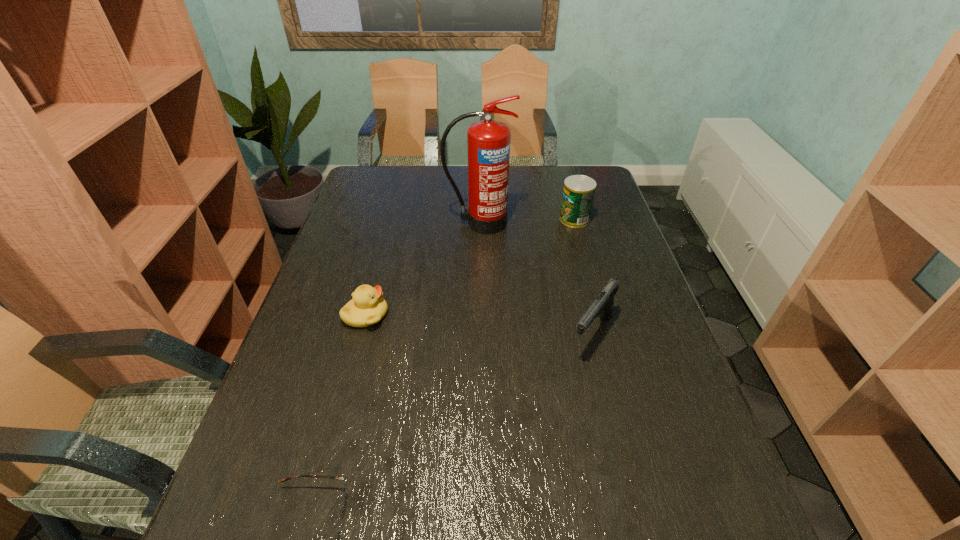
The width and height of the screenshot is (960, 540). I want to click on can at the right edge, so click(x=578, y=194).

At what (x,y) coordinates should I click in order to perform the action: click on gun at the right edge. Please return your answer as a coordinate pair (x, y). The width and height of the screenshot is (960, 540). Looking at the image, I should click on (603, 305).

I want to click on blank space at the far edge of the desktop, so click(x=449, y=172).

Image resolution: width=960 pixels, height=540 pixels. In the image, there is a desktop. Find the location of `vacant space at the left edge`. vacant space at the left edge is located at coordinates (330, 361).

Where is `vacant space at the right edge`? The width and height of the screenshot is (960, 540). vacant space at the right edge is located at coordinates (632, 261).

Locate an element on the screen. free space at the far left corner of the desktop is located at coordinates (348, 196).

Locate an element on the screen. This screenshot has height=540, width=960. free space between the tallest object and the gun is located at coordinates (536, 279).

Find the location of `vacant space in between the gun and the third object from left to right`. vacant space in between the gun and the third object from left to right is located at coordinates (536, 279).

Identify the location of vacant area that lies between the fourth tallest object and the third object from right to left. point(422,269).

Identify the location of free space between the can and the gun. (584, 276).